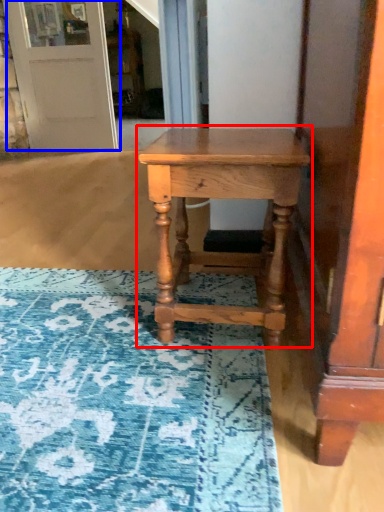
Question: Which point is closer to the camera, table (highlighted by a red box) or door (highlighted by a blue box)?

Choices:
 (A) table
 (B) door

Answer: (A)